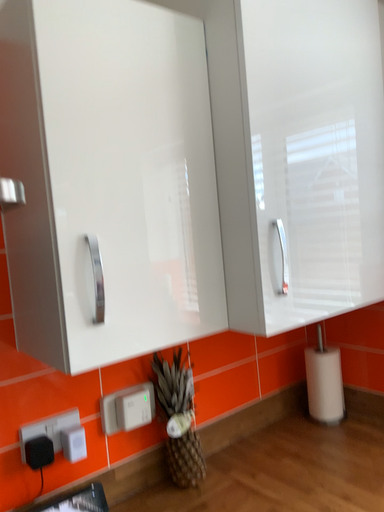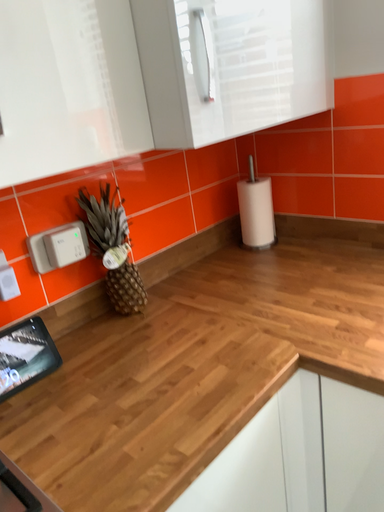
Question: How did the camera likely rotate when shooting the video?

Choices:
 (A) rotated downward
 (B) rotated upward

Answer: (A)